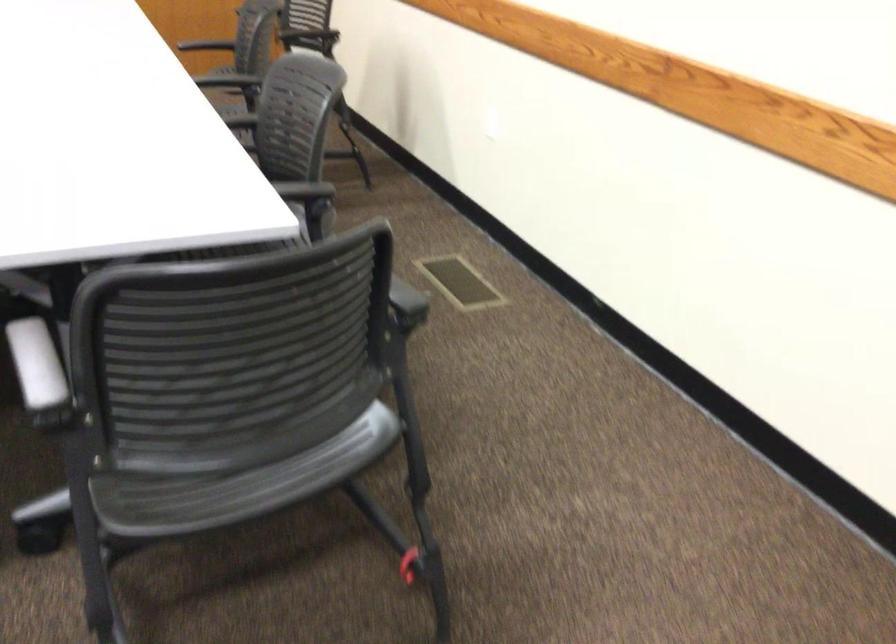
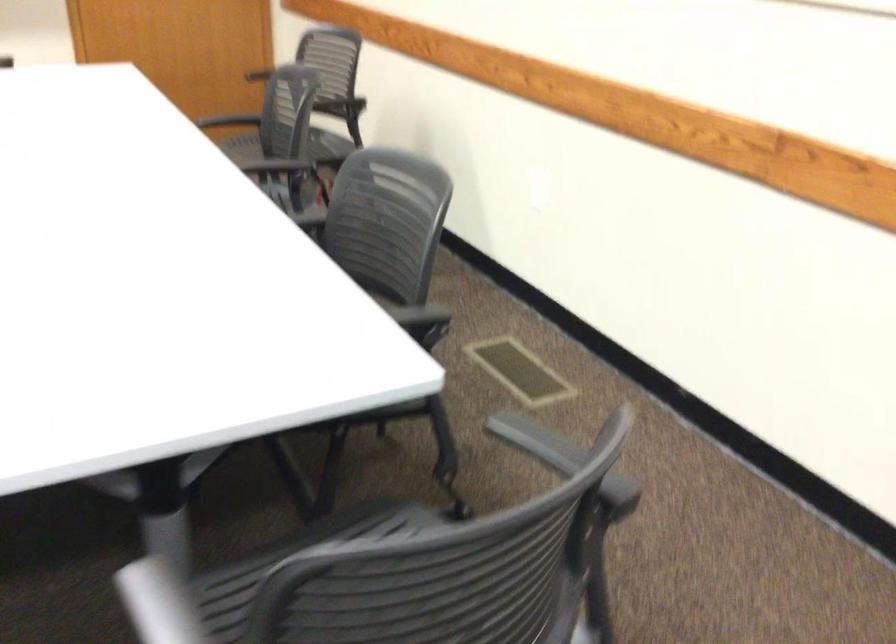
Question: The images are taken continuously from a first-person perspective. In which direction is your viewpoint rotating?

Choices:
 (A) Left
 (B) Right
 (C) Up
 (D) Down

Answer: (B)